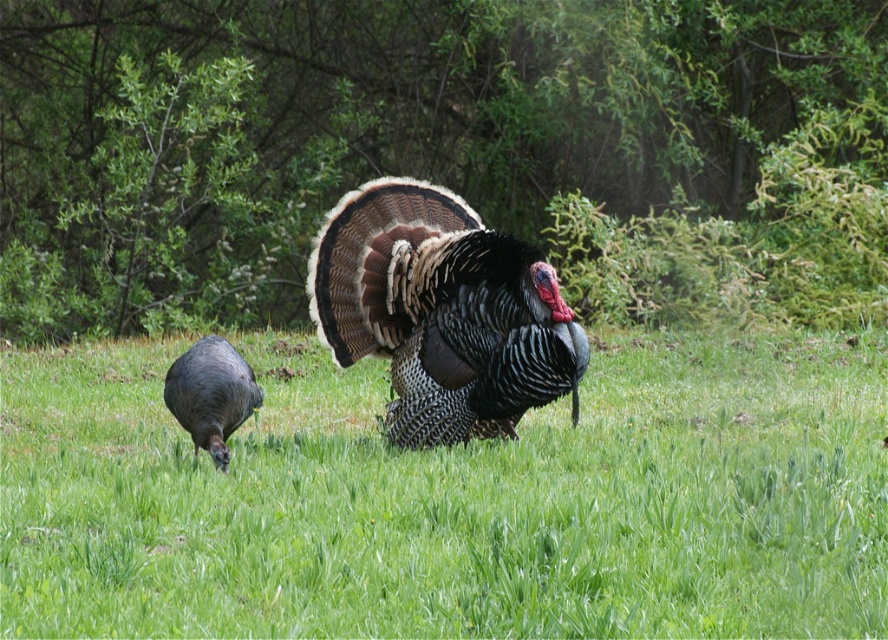
Question: Which object is farther from the camera taking this photo?

Choices:
 (A) shiny iridescent turkey at center
 (B) green grass at center

Answer: (B)

Question: Which point appears closest to the camera in this image?

Choices:
 (A) (461, 424)
 (B) (239, 396)
 (C) (809, 547)

Answer: (C)

Question: Is green grass at center wider than shiny dark gray turkey at lower left?

Choices:
 (A) no
 (B) yes

Answer: (A)

Question: Can you confirm if shiny iridescent turkey at center is smaller than shiny dark gray turkey at lower left?

Choices:
 (A) no
 (B) yes

Answer: (A)

Question: Which point appears closest to the camera in this image?

Choices:
 (A) (865, 416)
 (B) (176, 372)

Answer: (B)

Question: Does green grass at center appear over shiny iridescent turkey at center?

Choices:
 (A) no
 (B) yes

Answer: (A)